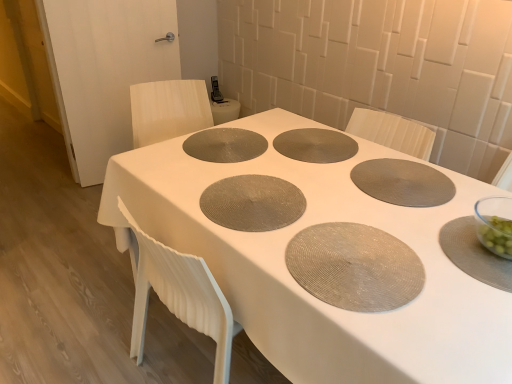
In order to click on free space between matte gray placemat at center, the 2th pizza pan when ordered from left to right, and matte gray placemat at center, acting as the first oval starting from the left in this screenshot , I will do `click(270, 149)`.